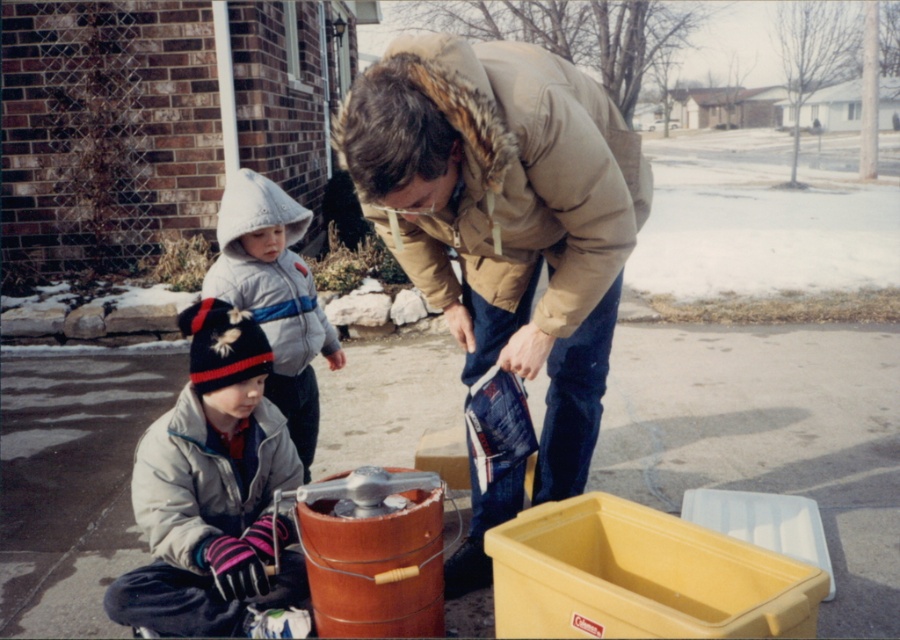
Question: Does tan fur-trimmed coat at center come behind white fleece jacket at lower left?

Choices:
 (A) yes
 (B) no

Answer: (B)

Question: Is the position of tan fur-trimmed coat at center more distant than that of white fleece jacket at lower left?

Choices:
 (A) no
 (B) yes

Answer: (A)

Question: Which object is positioned closest to the knitted wool hat at lower left?

Choices:
 (A) tan fur-trimmed coat at center
 (B) white fleece jacket at lower left

Answer: (B)

Question: Which of the following is the farthest from the observer?

Choices:
 (A) knitted wool hat at lower left
 (B) white fleece jacket at lower left
 (C) tan fur-trimmed coat at center

Answer: (A)

Question: Can you confirm if tan fur-trimmed coat at center is positioned to the right of white fleece jacket at lower left?

Choices:
 (A) yes
 (B) no

Answer: (A)

Question: Which of these objects is positioned farthest from the tan fur-trimmed coat at center?

Choices:
 (A) white fleece jacket at lower left
 (B) knitted wool hat at lower left

Answer: (B)